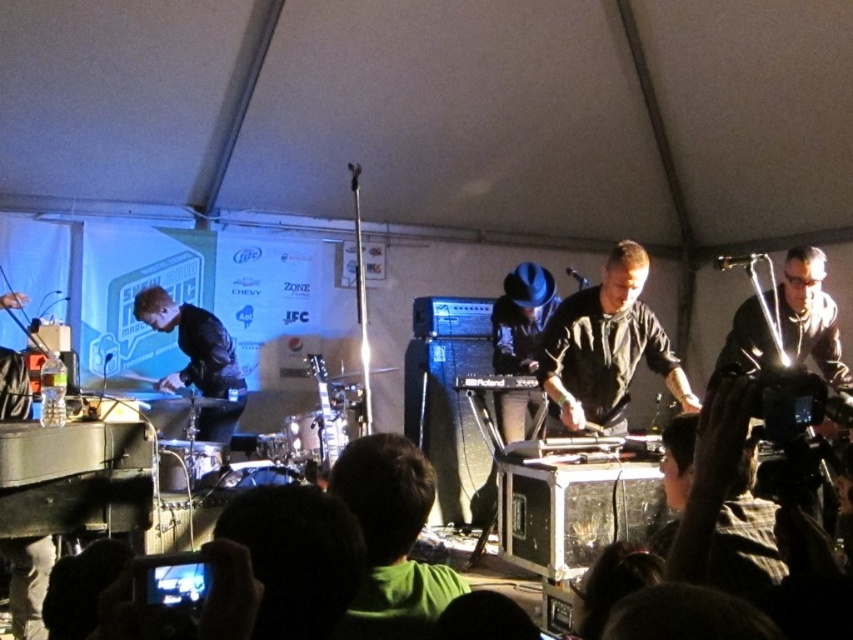
Question: Is black leather jacket at left to the left of black plastic roland keyboard at center from the viewer's perspective?

Choices:
 (A) yes
 (B) no

Answer: (A)

Question: Among these objects, which one is farthest from the camera?

Choices:
 (A) black leather jacket at left
 (B) black plastic roland keyboard at center
 (C) metallic guitar at center

Answer: (A)

Question: Does black leather jacket at left have a greater width compared to metallic guitar at center?

Choices:
 (A) yes
 (B) no

Answer: (A)

Question: Which of the following is the closest to the observer?

Choices:
 (A) 325,372
 (B) 503,380

Answer: (B)

Question: Is black leather jacket at left thinner than black plastic roland keyboard at center?

Choices:
 (A) no
 (B) yes

Answer: (A)

Question: Which of the following is the closest to the observer?

Choices:
 (A) black leather jacket at left
 (B) black plastic roland keyboard at center
 (C) metallic guitar at center

Answer: (C)